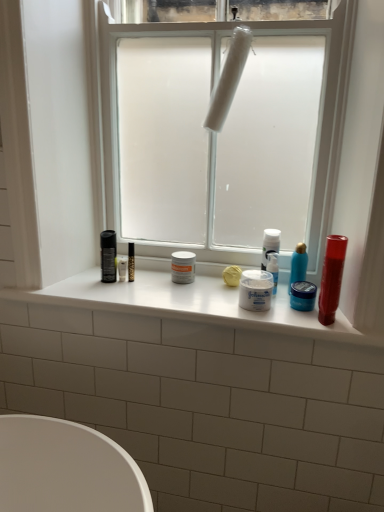
Question: Can you confirm if blue glossy bottle at center right, which ranks as the fourth toiletry in left-to-right order, is thinner than shiny red tube at right?

Choices:
 (A) no
 (B) yes

Answer: (B)

Question: Is the depth of blue glossy bottle at center right, which ranks as the fourth toiletry in left-to-right order, less than that of shiny red tube at right?

Choices:
 (A) no
 (B) yes

Answer: (A)

Question: Considering the relative sizes of blue glossy bottle at center right, which ranks as the fourth toiletry in left-to-right order, and shiny red tube at right in the image provided, is blue glossy bottle at center right, which ranks as the fourth toiletry in left-to-right order, bigger than shiny red tube at right?

Choices:
 (A) no
 (B) yes

Answer: (A)

Question: Can you see blue glossy bottle at center right, which ranks as the fourth toiletry in left-to-right order, touching shiny red tube at right?

Choices:
 (A) yes
 (B) no

Answer: (B)

Question: From the image's perspective, is blue glossy bottle at center right, the first toiletry positioned from the right, beneath shiny red tube at right?

Choices:
 (A) no
 (B) yes

Answer: (A)

Question: Can you confirm if blue glossy bottle at center right, which ranks as the fourth toiletry in left-to-right order, is positioned to the right of shiny red tube at right?

Choices:
 (A) yes
 (B) no

Answer: (B)

Question: Could blue glossy bottle at center right, which ranks as the fourth toiletry in left-to-right order, be considered to be inside blue matte jar at center, which is the third toiletry in left-to-right order?

Choices:
 (A) no
 (B) yes

Answer: (A)

Question: Is blue matte jar at center, which is the third toiletry in left-to-right order, smaller than blue glossy bottle at center right, which ranks as the fourth toiletry in left-to-right order?

Choices:
 (A) yes
 (B) no

Answer: (A)

Question: Can you confirm if blue matte jar at center, which is the third toiletry in left-to-right order, is wider than blue glossy bottle at center right, which ranks as the fourth toiletry in left-to-right order?

Choices:
 (A) no
 (B) yes

Answer: (B)

Question: Is blue matte jar at center, the second toiletry when ordered from right to left, thinner than blue glossy bottle at center right, the first toiletry positioned from the right?

Choices:
 (A) yes
 (B) no

Answer: (B)

Question: Is blue matte jar at center, which is the third toiletry in left-to-right order, taller than blue glossy bottle at center right, the first toiletry positioned from the right?

Choices:
 (A) no
 (B) yes

Answer: (A)

Question: Is blue matte jar at center, which is the third toiletry in left-to-right order, located outside blue glossy bottle at center right, which ranks as the fourth toiletry in left-to-right order?

Choices:
 (A) yes
 (B) no

Answer: (A)

Question: Is white glossy window sill at center far from white frosted glass window at center?

Choices:
 (A) yes
 (B) no

Answer: (B)